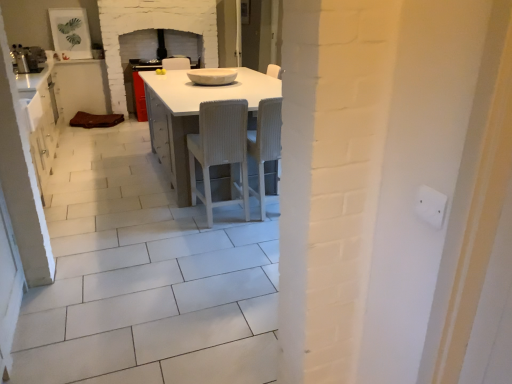
Question: Is white ribbed wood chair at center, which is the first chair in left-to-right order, to the right of white textured chair at center, which appears as the first chair when viewed from the right, from the viewer's perspective?

Choices:
 (A) yes
 (B) no

Answer: (B)

Question: Does white ribbed wood chair at center, which is the 2th chair from right to left, have a greater width compared to white textured chair at center, which appears as the first chair when viewed from the right?

Choices:
 (A) no
 (B) yes

Answer: (A)

Question: Is white ribbed wood chair at center, which is the first chair in left-to-right order, further to the viewer compared to white textured chair at center, which appears as the first chair when viewed from the right?

Choices:
 (A) yes
 (B) no

Answer: (B)

Question: Can we say white ribbed wood chair at center, which is the first chair in left-to-right order, lies outside white textured chair at center, the second chair when ordered from left to right?

Choices:
 (A) yes
 (B) no

Answer: (A)

Question: Is there a large distance between white ribbed wood chair at center, which is the first chair in left-to-right order, and white textured chair at center, the second chair when ordered from left to right?

Choices:
 (A) no
 (B) yes

Answer: (A)

Question: Does white ribbed wood chair at center, which is the first chair in left-to-right order, have a larger size compared to white textured chair at center, the second chair when ordered from left to right?

Choices:
 (A) yes
 (B) no

Answer: (A)

Question: From a real-world perspective, is white textured chair at center, which appears as the first chair when viewed from the right, positioned under white plastic electric outlet at upper right based on gravity?

Choices:
 (A) yes
 (B) no

Answer: (A)

Question: Does white textured chair at center, the second chair when ordered from left to right, have a lesser width compared to white plastic electric outlet at upper right?

Choices:
 (A) no
 (B) yes

Answer: (A)

Question: Can you confirm if white textured chair at center, the second chair when ordered from left to right, is positioned to the left of white plastic electric outlet at upper right?

Choices:
 (A) yes
 (B) no

Answer: (A)

Question: Is white textured chair at center, the second chair when ordered from left to right, not near white plastic electric outlet at upper right?

Choices:
 (A) no
 (B) yes

Answer: (B)

Question: From the image's perspective, would you say white textured chair at center, the second chair when ordered from left to right, is shown under white plastic electric outlet at upper right?

Choices:
 (A) yes
 (B) no

Answer: (B)

Question: Is white textured chair at center, which appears as the first chair when viewed from the right, touching white plastic electric outlet at upper right?

Choices:
 (A) no
 (B) yes

Answer: (A)

Question: Is white glossy table at center wider than white textured chair at center, the second chair when ordered from left to right?

Choices:
 (A) no
 (B) yes

Answer: (B)